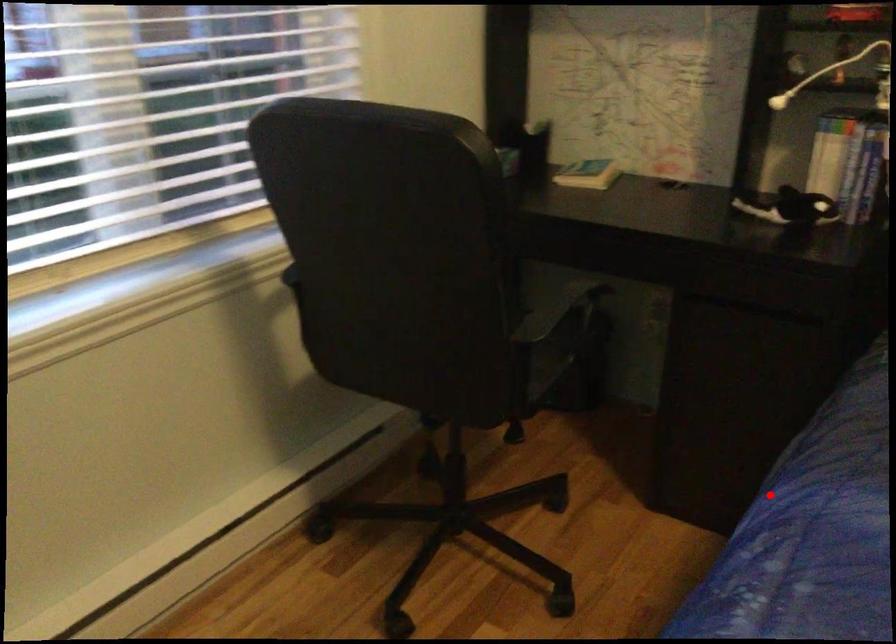
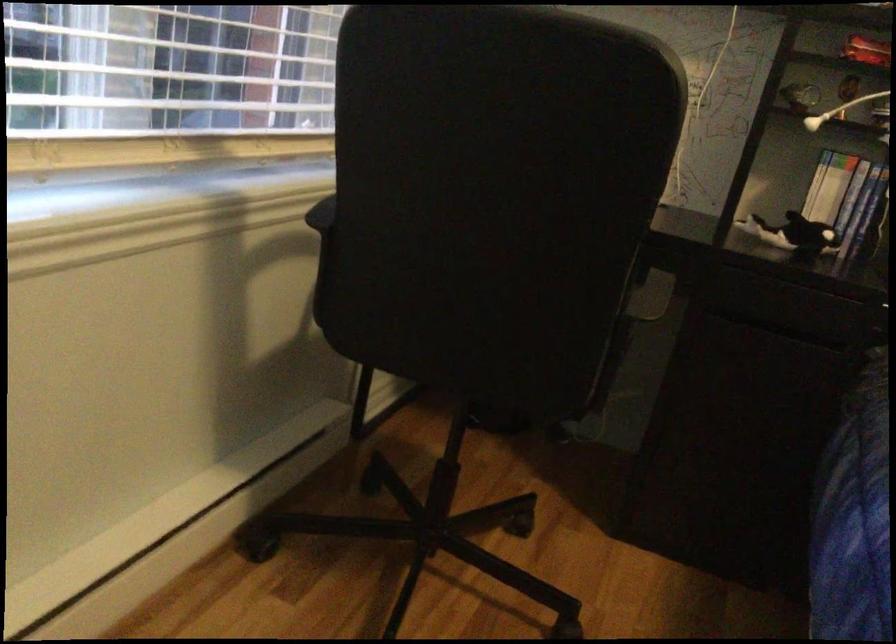
Find the pixel in the second image that matches the highlighted location in the first image.

(853, 518)